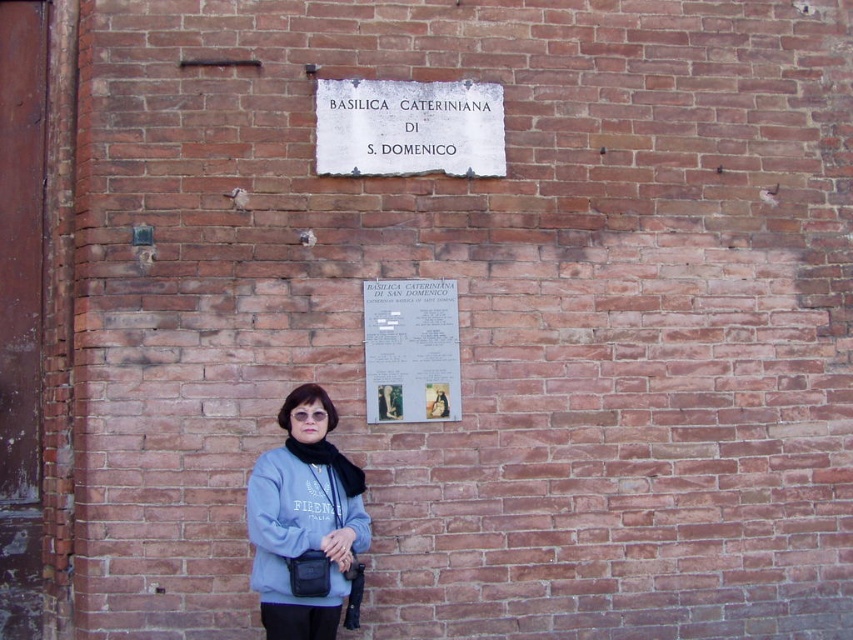
You are a tourist standing in front of the brick wall with two points marked. You want to touch both points starting from your current position. Which point should you reach first, point (469, 96) or point (439, 417)?

Point (469, 96) is further to the viewer than point (439, 417), so you should reach point (469, 96) first.

You are a tourist visiting the Basilica Cateriniana di San Domenico. You notice two items in front of you. One is the light blue fleece at center and the other is the white stone sign at upper center. Which item is larger in size?

The light blue fleece at center is bigger than the white stone sign at upper center, so the light blue fleece at center is larger in size.

You are an artist holding a light blue fleece at center and a white paper at upper center. You want to place both items on a shelf. If you arrange them according to their positions in the image, where should each item be placed?

The light blue fleece at center should be placed to the left of the white paper at upper center on the shelf, following their positions in the image.